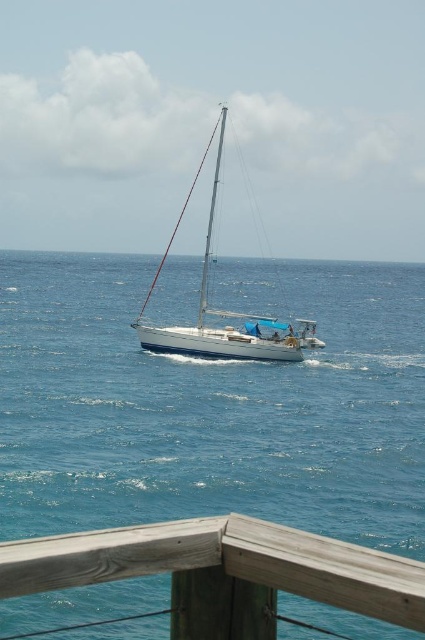
You are standing at the point labeled as point [414,346] in the image. You want to take a photo of the sailboat using a camera that has a 50mm lens. The camera is set to a focal length of 50mm. The recommended distance for a clear photo with this lens is at least 100 feet. Can you take a clear photo of the sailboat from your current position?

The distance between point [414,346] and the camera is 150.86 feet, which exceeds the recommended minimum distance of 100 feet. Therefore, you can take a clear photo of the sailboat from your current position.

You are a photographer aiming to capture the white glossy sailboat at center in the image. Given that the blue water at center occupies more space in the frame, how might you adjust your camera angle to ensure the sailboat is the focal point?

Since the blue water at center is wider than the white glossy sailboat at center, you can zoom in or move closer to the sailboat to reduce the amount of water visible and make the sailboat the primary focus.